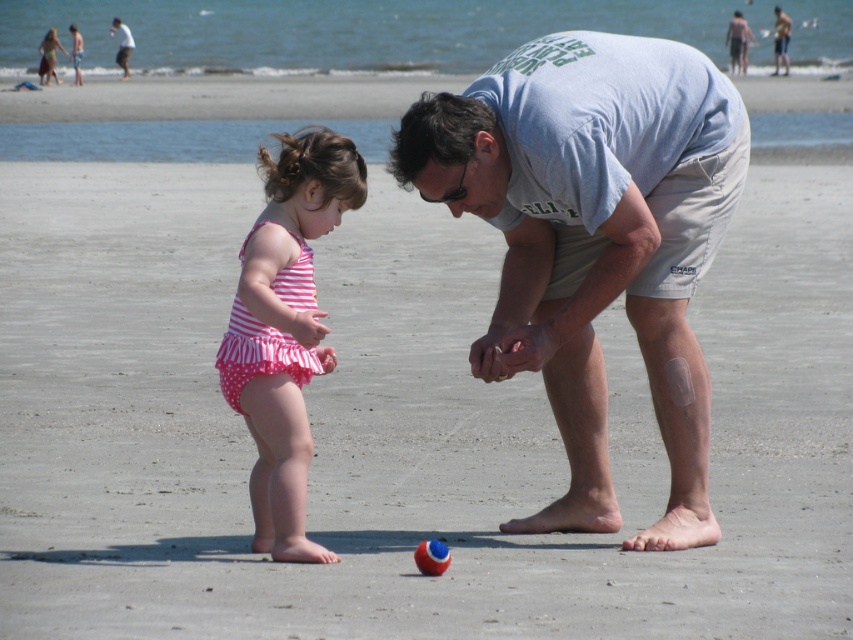
Question: Does pink polka dot swimsuit at left come in front of white cotton shirt at upper left?

Choices:
 (A) no
 (B) yes

Answer: (B)

Question: Does red glossy beach ball at center appear on the left side of white cotton shirt at upper left?

Choices:
 (A) no
 (B) yes

Answer: (A)

Question: In this image, where is pink polka dot swimsuit at left located relative to red glossy beach ball at center?

Choices:
 (A) below
 (B) above

Answer: (B)

Question: Which object is positioned farthest from the red glossy beach ball at center?

Choices:
 (A) gray cotton shirt at center
 (B) white cotton shirt at upper left
 (C) light blue t-shirt at center

Answer: (B)

Question: Which point is farther to the camera?

Choices:
 (A) gray cotton shirt at center
 (B) red glossy beach ball at center

Answer: (A)

Question: Which object appears farthest from the camera in this image?

Choices:
 (A) pink polka dot swimsuit at left
 (B) red glossy beach ball at center
 (C) white cotton shirt at upper left
 (D) gray cotton shirt at center

Answer: (C)